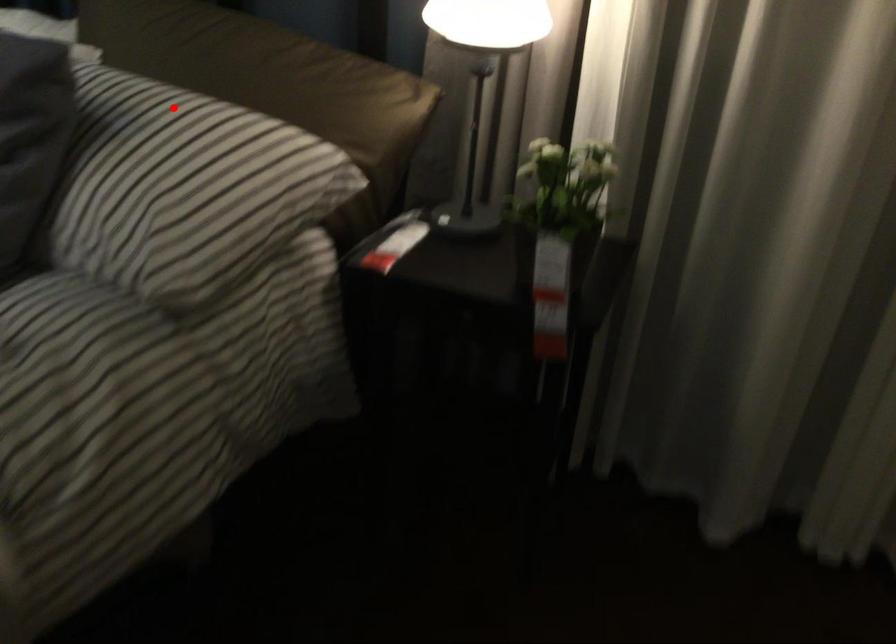
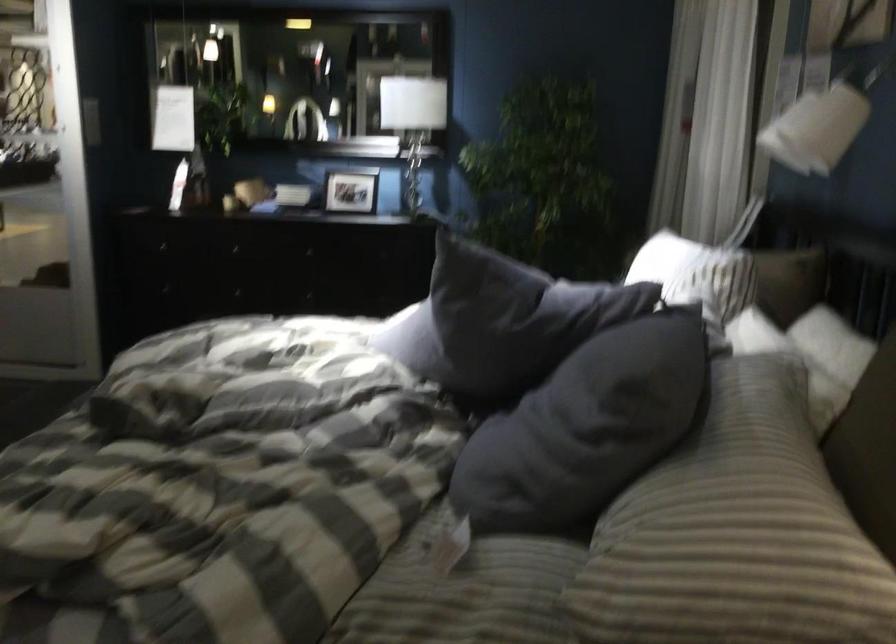
In the second image, find the point that corresponds to the highlighted location in the first image.

(760, 453)